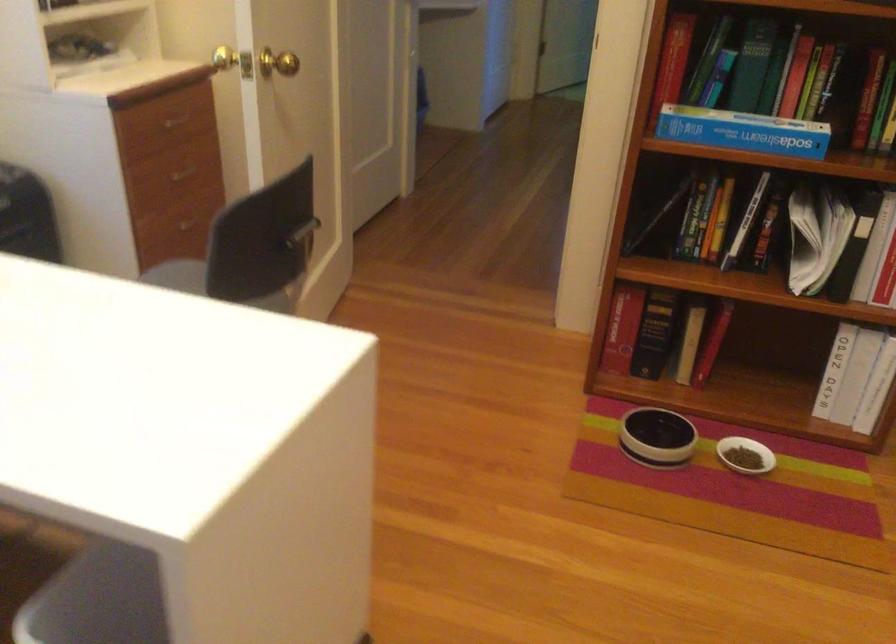
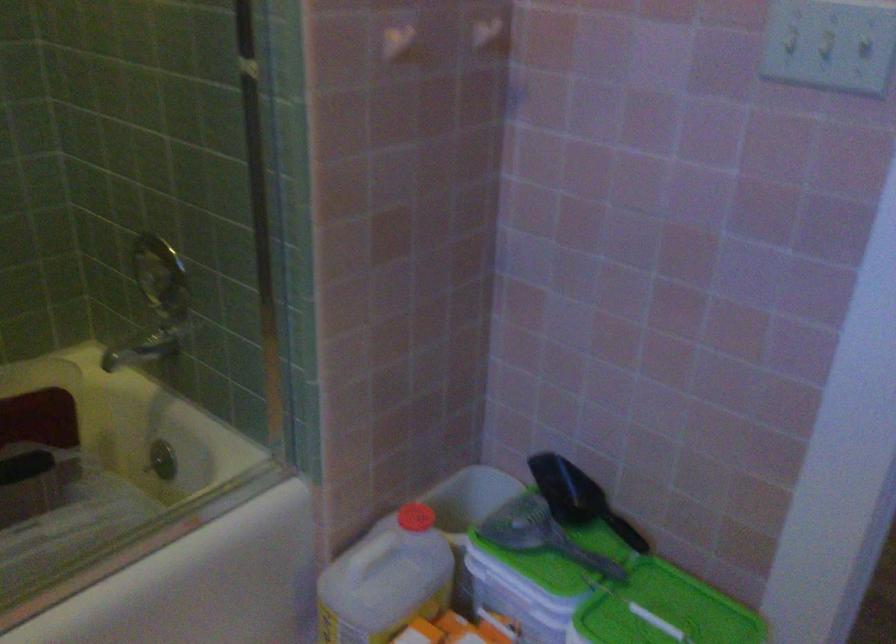
Question: I am providing you with two images of the same scene from different viewpoints. Which of the following objects are not visible in image2?

Choices:
 (A) card reader slot
 (B) light switch
 (C) chair back handle
 (D) white plastic jug

Answer: (C)